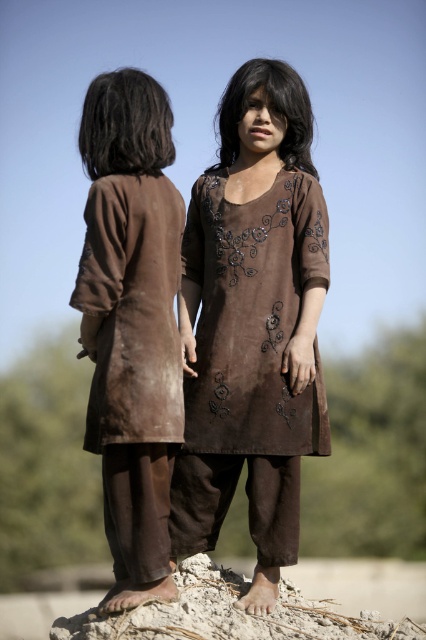
Question: Can you confirm if brown suede dress at left is bigger than brown suede dress at center?

Choices:
 (A) no
 (B) yes

Answer: (A)

Question: Which object is farther from the camera taking this photo?

Choices:
 (A) brown suede dress at left
 (B) brown suede dress at center

Answer: (B)

Question: Can you confirm if brown suede kurta at center is thinner than brown suede dress at center?

Choices:
 (A) no
 (B) yes

Answer: (A)

Question: Estimate the real-world distances between objects in this image. Which object is closer to the brown suede kurta at center?

Choices:
 (A) brown suede dress at center
 (B) brown suede dress at left

Answer: (A)

Question: Does brown suede kurta at center appear on the left side of brown suede dress at left?

Choices:
 (A) no
 (B) yes

Answer: (A)

Question: Which point appears closest to the camera in this image?

Choices:
 (A) click(224, 272)
 (B) click(241, 388)

Answer: (B)